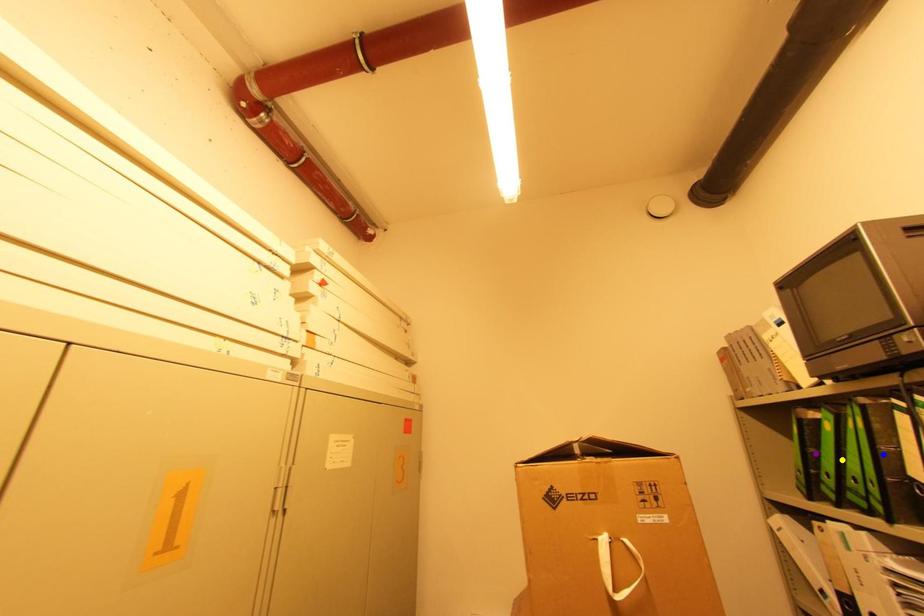
Order these from nearest to farthest:
- yellow point
- blue point
- purple point

blue point → yellow point → purple point